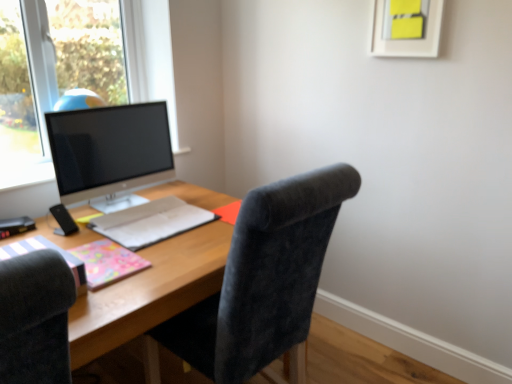
The height and width of the screenshot is (384, 512). Find the location of `vacant region above pink glossy notebook at lower left, positioned as the 2th notebook in back-to-front order (from a real-world perspective)`. vacant region above pink glossy notebook at lower left, positioned as the 2th notebook in back-to-front order (from a real-world perspective) is located at coordinates (104, 255).